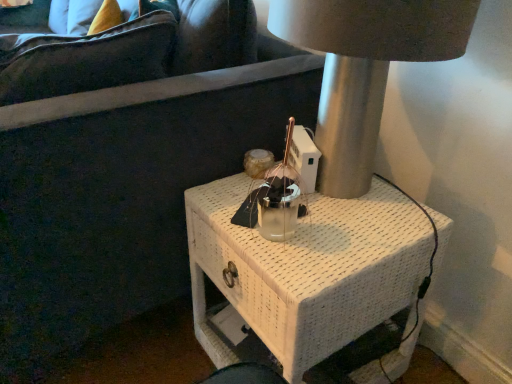
Question: Is white woven nightstand at center in front of or behind metallic silver lamp at center in the image?

Choices:
 (A) behind
 (B) front

Answer: (A)

Question: Considering the positions of white woven nightstand at center and metallic silver lamp at center in the image, is white woven nightstand at center wider or thinner than metallic silver lamp at center?

Choices:
 (A) thin
 (B) wide

Answer: (B)

Question: Considering the positions of point (348, 299) and point (349, 44), is point (348, 299) closer or farther from the camera than point (349, 44)?

Choices:
 (A) farther
 (B) closer

Answer: (A)

Question: Looking at their shapes, would you say metallic silver lamp at center is wider or thinner than white woven nightstand at center?

Choices:
 (A) thin
 (B) wide

Answer: (A)

Question: From a real-world perspective, relative to white woven nightstand at center, is metallic silver lamp at center vertically above or below?

Choices:
 (A) below
 (B) above

Answer: (B)

Question: Considering their positions, is metallic silver lamp at center located in front of or behind white woven nightstand at center?

Choices:
 (A) front
 (B) behind

Answer: (A)

Question: From the image's perspective, is metallic silver lamp at center positioned above or below white woven nightstand at center?

Choices:
 (A) below
 (B) above

Answer: (B)